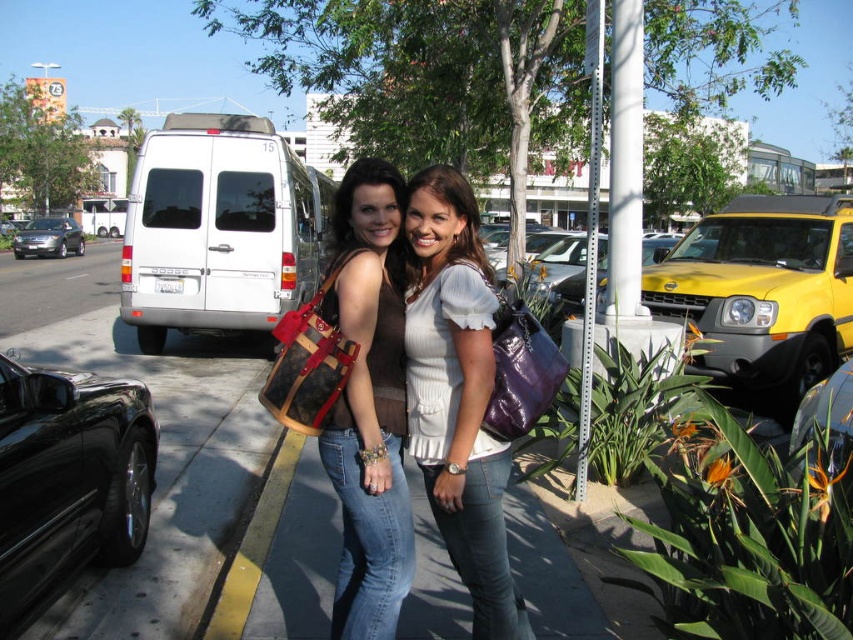
Question: Among these points, which one is nearest to the camera?

Choices:
 (A) (50, 237)
 (B) (456, 483)
 (C) (45, 428)
 (D) (317, 301)

Answer: (B)

Question: Which object appears closest to the camera in this image?

Choices:
 (A) purple shiny handbag at center
 (B) white matte van at center

Answer: (A)

Question: Can you confirm if brown leather purse at center is positioned to the left of shiny silver sedan at left?

Choices:
 (A) no
 (B) yes

Answer: (A)

Question: Is brown leather bucket bag at center behind black glossy car at lower right?

Choices:
 (A) no
 (B) yes

Answer: (B)

Question: Among these points, which one is nearest to the camera?

Choices:
 (A) (451, 280)
 (B) (815, 394)
 (C) (398, 296)

Answer: (A)

Question: Is white matte van at center above brown leather bucket bag at center?

Choices:
 (A) no
 (B) yes

Answer: (B)